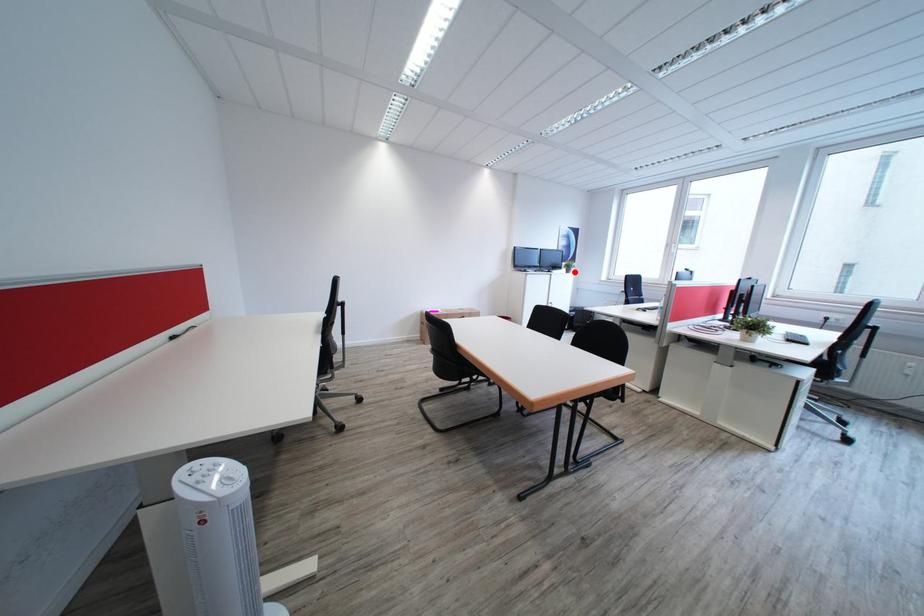
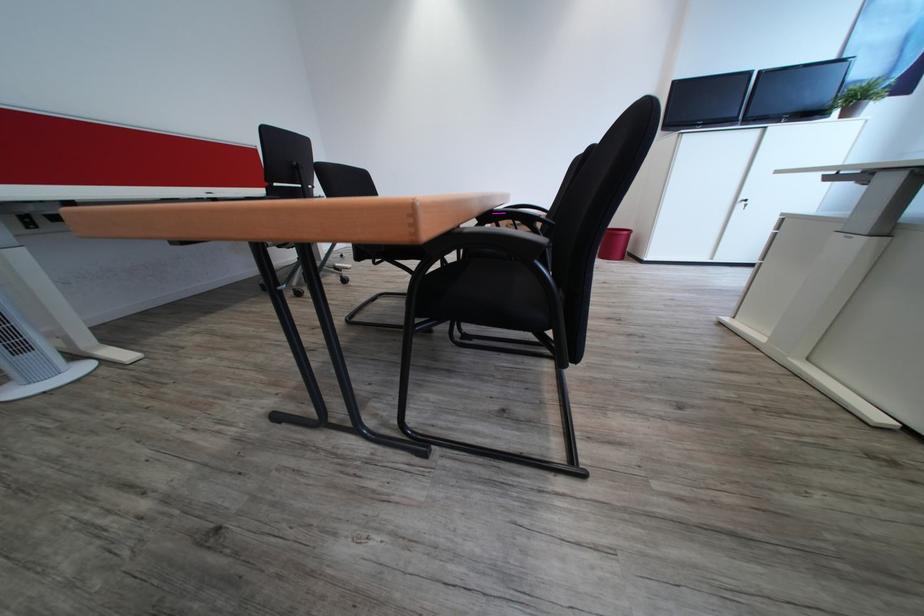
In the second image, find the point that corresponds to the highlighted location in the first image.

(845, 116)